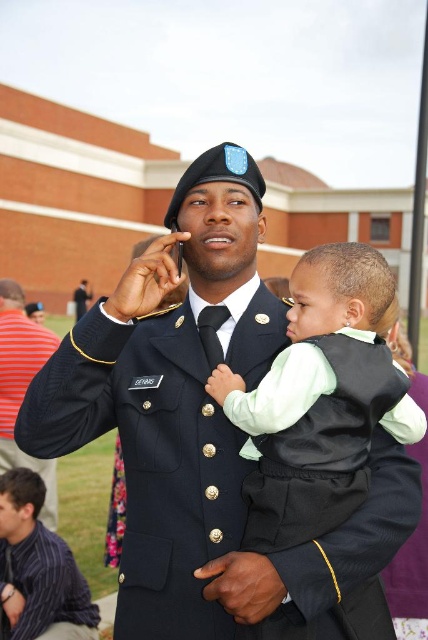
You are a tailor measuring fabrics for alterations. You need to determine if the soft green fabric vest at center can fit over the uniformed man at center. Based on their sizes, what would you advise?

The uniformed man at center is wider than the soft green fabric vest at center, so the vest may not fit comfortably over him. Consider selecting a larger vest or adjusting the current one to accommodate his width.

You are a photographer trying to capture a candid shot of the scene. You notice a point at coordinates (x=202, y=429). What object is located at that point?

The point at coordinates (x=202, y=429) is where the uniformed man at center is located.